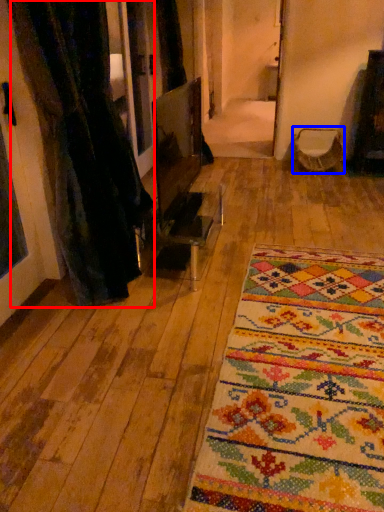
Question: Which of the following is the farthest to the observer, curtain (highlighted by a red box) or armchair (highlighted by a blue box)?

Choices:
 (A) curtain
 (B) armchair

Answer: (B)